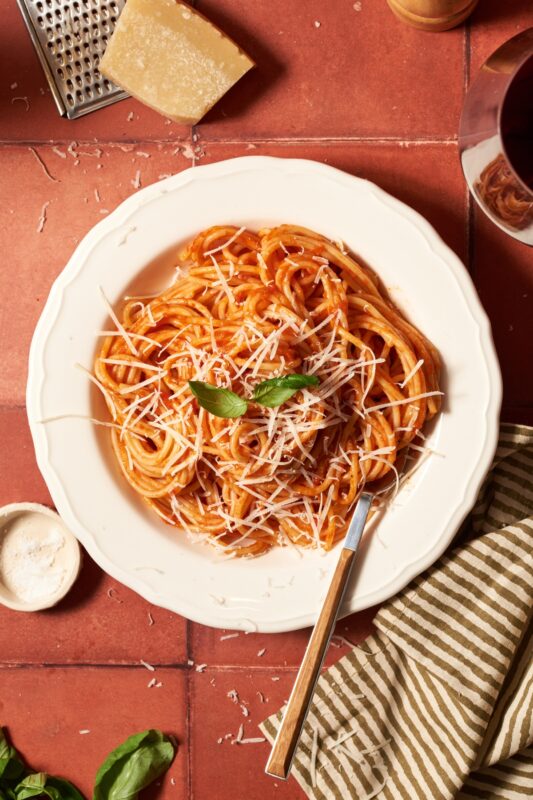
Locate an element on the screen. small white cup of grated cheese is located at coordinates (52, 584).